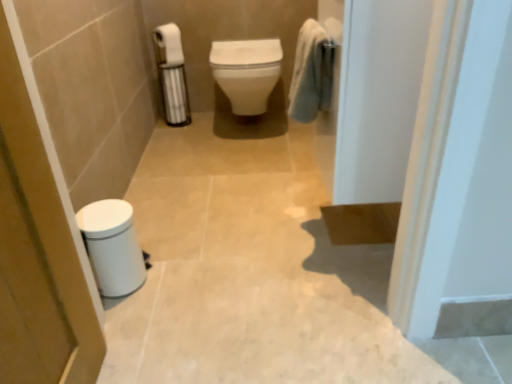
Question: Is white glossy trash can at lower left located within white glossy toilet at center?

Choices:
 (A) no
 (B) yes

Answer: (A)

Question: From a real-world perspective, is white glossy toilet at center located higher than white glossy trash can at lower left?

Choices:
 (A) yes
 (B) no

Answer: (A)

Question: Are white glossy toilet at center and white glossy trash can at lower left far apart?

Choices:
 (A) yes
 (B) no

Answer: (A)

Question: Can you confirm if white glossy toilet at center is shorter than white glossy trash can at lower left?

Choices:
 (A) yes
 (B) no

Answer: (A)

Question: Is white glossy toilet at center smaller than white glossy trash can at lower left?

Choices:
 (A) no
 (B) yes

Answer: (A)

Question: Does white glossy toilet at center have a greater height compared to white glossy trash can at lower left?

Choices:
 (A) yes
 (B) no

Answer: (B)

Question: Can you confirm if white matte trash can at lower left, positioned as the 1th screen door in left-to-right order, is thinner than soft blue towel at upper right?

Choices:
 (A) yes
 (B) no

Answer: (A)

Question: Would you say soft blue towel at upper right is part of white matte trash can at lower left, the 2th screen door from the right,'s contents?

Choices:
 (A) no
 (B) yes

Answer: (A)

Question: Does white matte trash can at lower left, positioned as the 1th screen door in left-to-right order, have a smaller size compared to soft blue towel at upper right?

Choices:
 (A) no
 (B) yes

Answer: (A)

Question: Considering the relative sizes of white matte trash can at lower left, the 2th screen door from the right, and soft blue towel at upper right in the image provided, is white matte trash can at lower left, the 2th screen door from the right, bigger than soft blue towel at upper right?

Choices:
 (A) no
 (B) yes

Answer: (B)

Question: Does white matte trash can at lower left, positioned as the 1th screen door in left-to-right order, appear on the right side of soft blue towel at upper right?

Choices:
 (A) no
 (B) yes

Answer: (A)

Question: Is white matte trash can at lower left, the 2th screen door from the right, closer to the viewer compared to soft blue towel at upper right?

Choices:
 (A) yes
 (B) no

Answer: (A)

Question: Is white glossy toilet at center to the left of soft blue towel at upper right from the viewer's perspective?

Choices:
 (A) no
 (B) yes

Answer: (B)